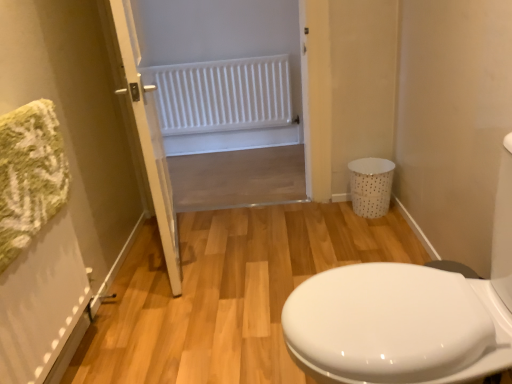
Question: Is the depth of white dotted plastic laundry basket at right less than that of white matte radiator at upper center?

Choices:
 (A) yes
 (B) no

Answer: (A)

Question: Considering the relative sizes of white dotted plastic laundry basket at right and white matte radiator at upper center in the image provided, is white dotted plastic laundry basket at right thinner than white matte radiator at upper center?

Choices:
 (A) no
 (B) yes

Answer: (A)

Question: Is white dotted plastic laundry basket at right at the left side of white matte radiator at upper center?

Choices:
 (A) yes
 (B) no

Answer: (B)

Question: From a real-world perspective, does white dotted plastic laundry basket at right stand above white matte radiator at upper center?

Choices:
 (A) yes
 (B) no

Answer: (B)

Question: From a real-world perspective, is white dotted plastic laundry basket at right beneath white matte radiator at upper center?

Choices:
 (A) no
 (B) yes

Answer: (B)

Question: Is white dotted plastic laundry basket at right outside of white matte radiator at upper center?

Choices:
 (A) no
 (B) yes

Answer: (B)

Question: Is white matte radiator at upper center with white dotted plastic laundry basket at right?

Choices:
 (A) no
 (B) yes

Answer: (A)

Question: Can you confirm if white matte radiator at upper center is positioned to the left of white dotted plastic laundry basket at right?

Choices:
 (A) yes
 (B) no

Answer: (A)

Question: From a real-world perspective, is white matte radiator at upper center positioned under white dotted plastic laundry basket at right based on gravity?

Choices:
 (A) no
 (B) yes

Answer: (A)

Question: From the image's perspective, is white matte radiator at upper center over white dotted plastic laundry basket at right?

Choices:
 (A) yes
 (B) no

Answer: (A)

Question: From a real-world perspective, is white matte radiator at upper center over white dotted plastic laundry basket at right?

Choices:
 (A) no
 (B) yes

Answer: (B)

Question: Is white matte radiator at upper center looking in the opposite direction of white dotted plastic laundry basket at right?

Choices:
 (A) yes
 (B) no

Answer: (B)

Question: Are white dotted plastic laundry basket at right and white plastic radiator at upper center located far from each other?

Choices:
 (A) yes
 (B) no

Answer: (B)